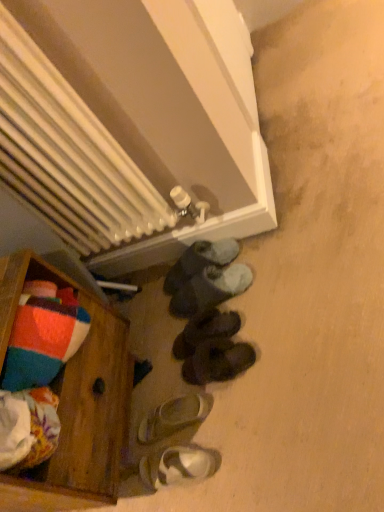
At what (x,y) coordinates should I click in order to perform the action: click on spots to the right of black suede slippers at center, which appears as the 4th footwear when ordered from the bottom. Please return your answer as a coordinate pair (x, y). This screenshot has height=512, width=384. Looking at the image, I should click on (255, 306).